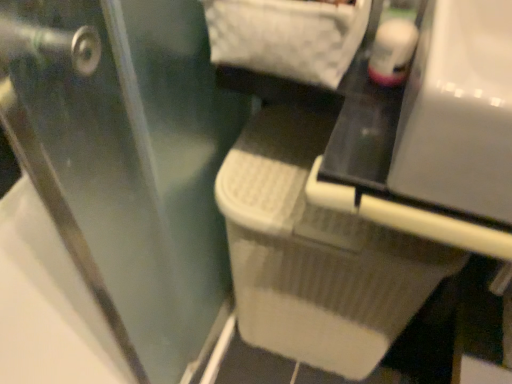
I want to click on white plastic vanity at center, so click(x=434, y=137).

Image resolution: width=512 pixels, height=384 pixels. In order to click on white textured laundry basket at center in this screenshot , I will do `click(315, 254)`.

Find the location of a particular element. white plastic vanity at center is located at coordinates (434, 137).

Find the location of a particular element. Image resolution: width=512 pixels, height=384 pixels. screen door lying below the white plastic vanity at center (from the image's perspective) is located at coordinates (127, 161).

Is transparent plastic screen door at lower right bigger than white plastic vanity at center?

Correct, transparent plastic screen door at lower right is larger in size than white plastic vanity at center.

Consider the image. Is transparent plastic screen door at lower right positioned with its back to white plastic vanity at center?

That's right, transparent plastic screen door at lower right is facing away from white plastic vanity at center.

Would you say white plastic vanity at center is part of transparent plastic screen door at lower right's contents?

That's incorrect, white plastic vanity at center is not inside transparent plastic screen door at lower right.

Considering the sizes of transparent plastic screen door at lower right and white textured laundry basket at center in the image, is transparent plastic screen door at lower right taller or shorter than white textured laundry basket at center?

transparent plastic screen door at lower right is taller than white textured laundry basket at center.

Which point is more forward, (3,113) or (298,358)?

Positioned in front is point (3,113).

From a real-world perspective, is transparent plastic screen door at lower right located beneath white textured laundry basket at center?

No, from a real-world perspective, transparent plastic screen door at lower right is not under white textured laundry basket at center.

From a real-world perspective, is white textured laundry basket at center beneath white plastic vanity at center?

Yes, from a real-world perspective, white textured laundry basket at center is beneath white plastic vanity at center.

Is white textured laundry basket at center outside of white plastic vanity at center?

Absolutely, white textured laundry basket at center is external to white plastic vanity at center.

Based on the photo, from the image's perspective, would you say white textured laundry basket at center is positioned over white plastic vanity at center?

No, from the image's perspective, white textured laundry basket at center is not over white plastic vanity at center.

Does point (330, 324) lie in front of point (451, 190)?

No, it is behind (451, 190).

The width and height of the screenshot is (512, 384). In order to click on vanity above the transparent plastic screen door at lower right (from a real-world perspective) in this screenshot , I will do `click(434, 137)`.

Does point (316, 179) lie behind point (88, 248)?

That is False.

Is white plastic vanity at center inside or outside of transparent plastic screen door at lower right?

white plastic vanity at center is not inside transparent plastic screen door at lower right, it's outside.

Which of these two, white plastic vanity at center or transparent plastic screen door at lower right, is bigger?

transparent plastic screen door at lower right is bigger.

Does white textured laundry basket at center have a larger size compared to transparent plastic screen door at lower right?

Yes, white textured laundry basket at center is bigger than transparent plastic screen door at lower right.

Is white textured laundry basket at center aimed at transparent plastic screen door at lower right?

Yes, white textured laundry basket at center is aimed at transparent plastic screen door at lower right.

How distant is white textured laundry basket at center from transparent plastic screen door at lower right?

white textured laundry basket at center and transparent plastic screen door at lower right are 7.69 inches apart from each other.

Are white textured laundry basket at center and transparent plastic screen door at lower right beside each other?

No, white textured laundry basket at center is not beside transparent plastic screen door at lower right.

Who is smaller, white plastic vanity at center or white textured laundry basket at center?

With smaller size is white plastic vanity at center.

This screenshot has width=512, height=384. I want to click on vanity that is above the white textured laundry basket at center (from a real-world perspective), so click(x=434, y=137).

Can you tell me how much white plastic vanity at center and white textured laundry basket at center differ in facing direction?

There is a 1.78-degree angle between the facing directions of white plastic vanity at center and white textured laundry basket at center.

Is white plastic vanity at center oriented towards white textured laundry basket at center?

No, white plastic vanity at center is not aimed at white textured laundry basket at center.

The image size is (512, 384). What are the coordinates of `vanity on the right side of transparent plastic screen door at lower right` in the screenshot? It's located at pyautogui.click(x=434, y=137).

Find the location of a particular element. The width and height of the screenshot is (512, 384). screen door in front of the white textured laundry basket at center is located at coordinates click(127, 161).

From the image, which object appears to be farther from white textured laundry basket at center, transparent plastic screen door at lower right or white plastic vanity at center?

white plastic vanity at center is positioned further to the anchor white textured laundry basket at center.

From the image, which object appears to be nearer to transparent plastic screen door at lower right, white plastic vanity at center or white textured laundry basket at center?

The object closer to transparent plastic screen door at lower right is white textured laundry basket at center.

Considering their positions, is white plastic vanity at center positioned further to white textured laundry basket at center than transparent plastic screen door at lower right?

Among the two, white plastic vanity at center is located further to white textured laundry basket at center.

Looking at the image, which one is located further to white plastic vanity at center, white textured laundry basket at center or transparent plastic screen door at lower right?

transparent plastic screen door at lower right lies further to white plastic vanity at center than the other object.

Considering their positions, is transparent plastic screen door at lower right positioned further to white plastic vanity at center than white textured laundry basket at center?

Based on the image, transparent plastic screen door at lower right appears to be further to white plastic vanity at center.

Looking at the image, which one is located closer to transparent plastic screen door at lower right, white textured laundry basket at center or white plastic vanity at center?

white textured laundry basket at center.

Identify the location of vanity between transparent plastic screen door at lower right and white textured laundry basket at center from front to back. (434, 137).